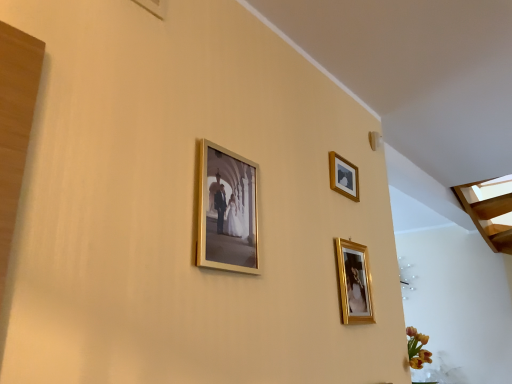
Question: Considering the positions of point (205, 206) and point (368, 284), is point (205, 206) closer or farther from the camera than point (368, 284)?

Choices:
 (A) farther
 (B) closer

Answer: (B)

Question: From the image's perspective, is gold metallic photo frame at center, acting as the third picture frame starting from the right, above or below gold metallic picture frame at lower right, which is the first picture frame in right-to-left order?

Choices:
 (A) below
 (B) above

Answer: (B)

Question: Based on their relative distances, which object is nearer to the gold metallic photo frame at center, the first picture frame when ordered from left to right?

Choices:
 (A) gold metallic picture frame at lower right, positioned as the third picture frame in left-to-right order
 (B) wooden picture frame at upper right, which is the first picture frame from back to front

Answer: (A)

Question: Which object is the closest to the gold metallic picture frame at lower right, which appears as the second picture frame when viewed from the back?

Choices:
 (A) gold metallic photo frame at center, arranged as the third picture frame when viewed from the back
 (B) wooden picture frame at upper right, which is the first picture frame from back to front

Answer: (B)